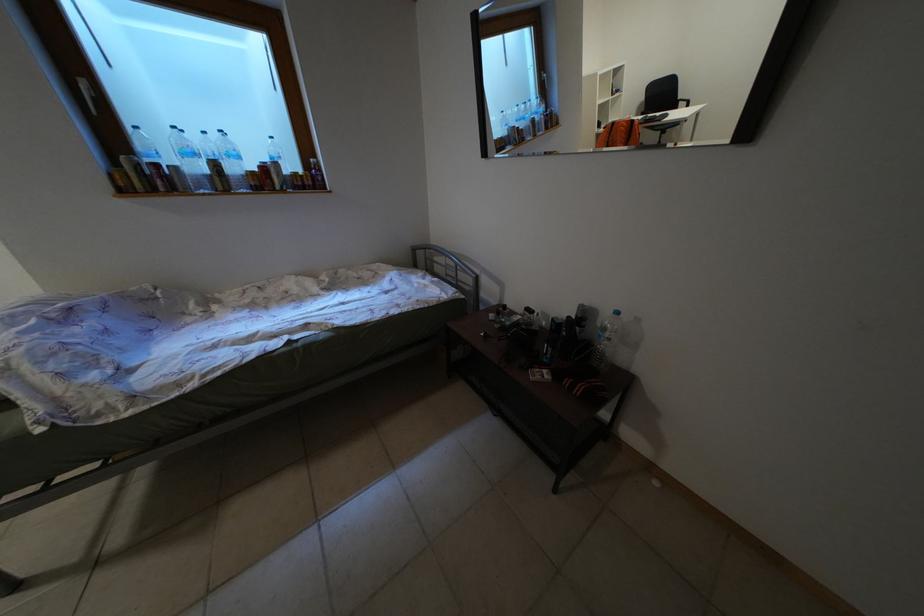
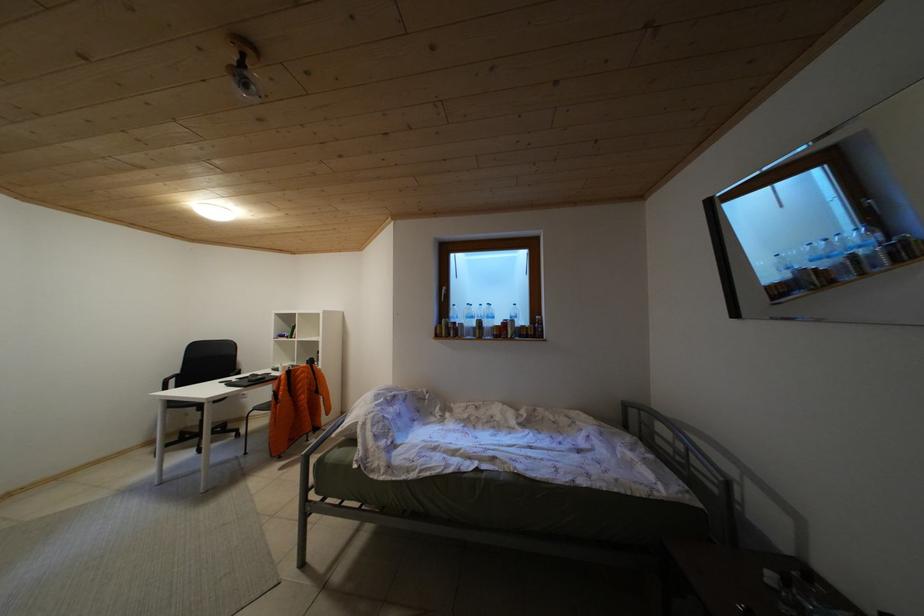
How did the camera likely rotate?

The rotation direction of the camera is left-up.